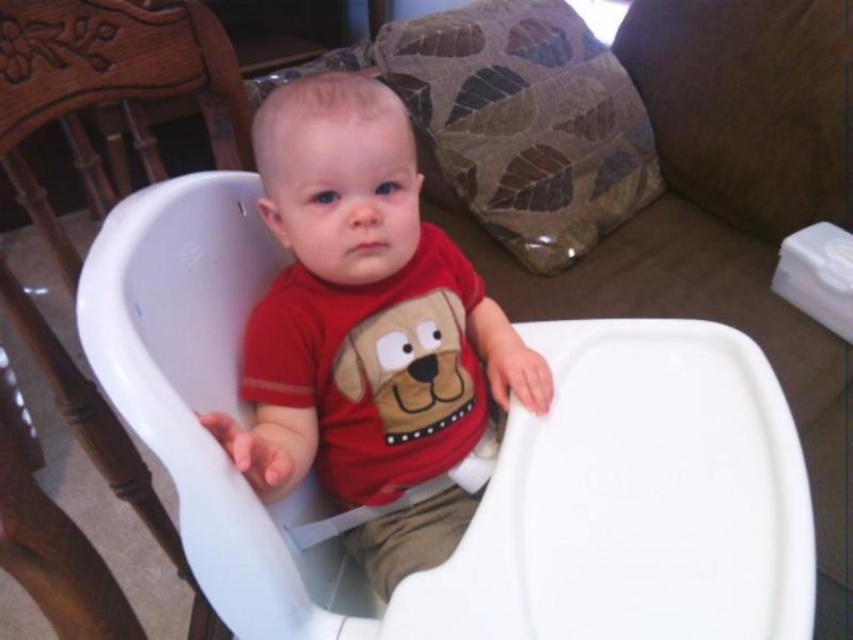
Question: Which of the following is the closest to the observer?

Choices:
 (A) matte red shirt at center
 (B) white plastic feeding chair at center
 (C) white plastic highchair at center

Answer: (B)

Question: Which object appears closest to the camera in this image?

Choices:
 (A) white plastic feeding chair at center
 (B) white plastic highchair at center

Answer: (A)

Question: Is white plastic feeding chair at center to the right of matte red shirt at center from the viewer's perspective?

Choices:
 (A) yes
 (B) no

Answer: (A)

Question: Which point is closer to the camera taking this photo?

Choices:
 (A) (666, 454)
 (B) (42, 568)
 (C) (442, 406)

Answer: (B)

Question: Is white plastic feeding chair at center to the right of white plastic highchair at center from the viewer's perspective?

Choices:
 (A) no
 (B) yes

Answer: (B)

Question: Can you confirm if white plastic feeding chair at center is positioned below matte red shirt at center?

Choices:
 (A) yes
 (B) no

Answer: (A)